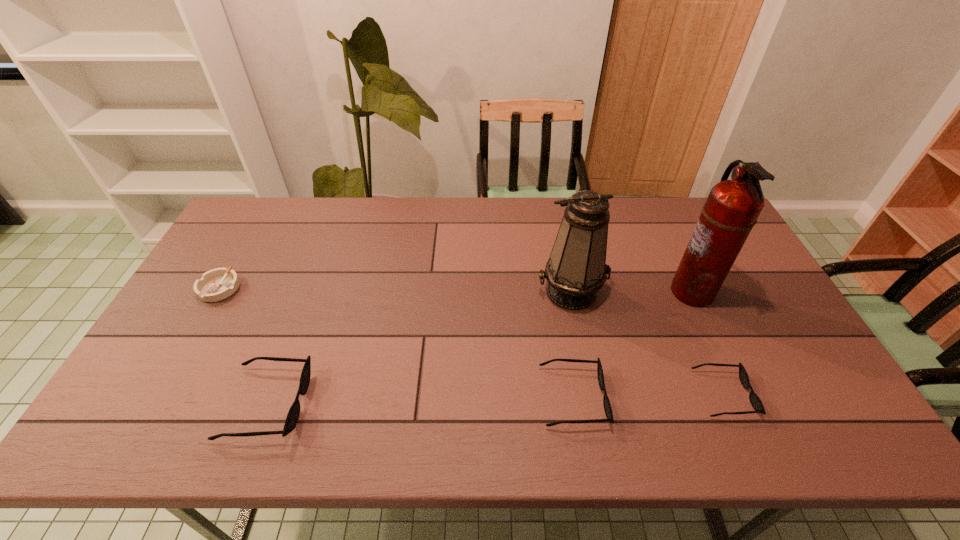
Where is `the fourth shortest object`? The width and height of the screenshot is (960, 540). the fourth shortest object is located at coordinates (292, 417).

At what (x,y) coordinates should I click in order to perform the action: click on the leftmost sunglasses. Please return your answer as a coordinate pair (x, y). Looking at the image, I should click on (292, 417).

This screenshot has height=540, width=960. Identify the location of the fourth tallest object. (606, 402).

The width and height of the screenshot is (960, 540). What are the coordinates of `the second sunglasses from left to right` in the screenshot? It's located at (606, 402).

The image size is (960, 540). In order to click on the shortest sunglasses in this screenshot , I will do `click(755, 401)`.

The image size is (960, 540). In order to click on oil lamp in this screenshot , I will do `click(576, 269)`.

Where is `fire extinguisher`? fire extinguisher is located at coordinates (732, 208).

Where is `the leftmost object`? The width and height of the screenshot is (960, 540). the leftmost object is located at coordinates (217, 284).

Identify the location of free space located on the front-facing side of the leftmost sunglasses. This screenshot has width=960, height=540. (353, 403).

Where is `vacant point located on the front-facing side of the third shortest object`? Image resolution: width=960 pixels, height=540 pixels. vacant point located on the front-facing side of the third shortest object is located at coordinates (719, 397).